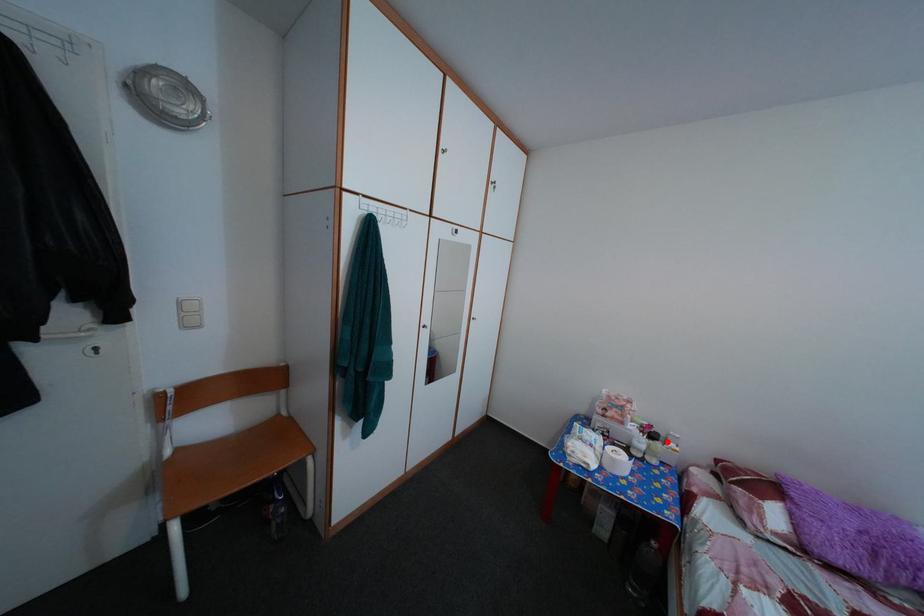
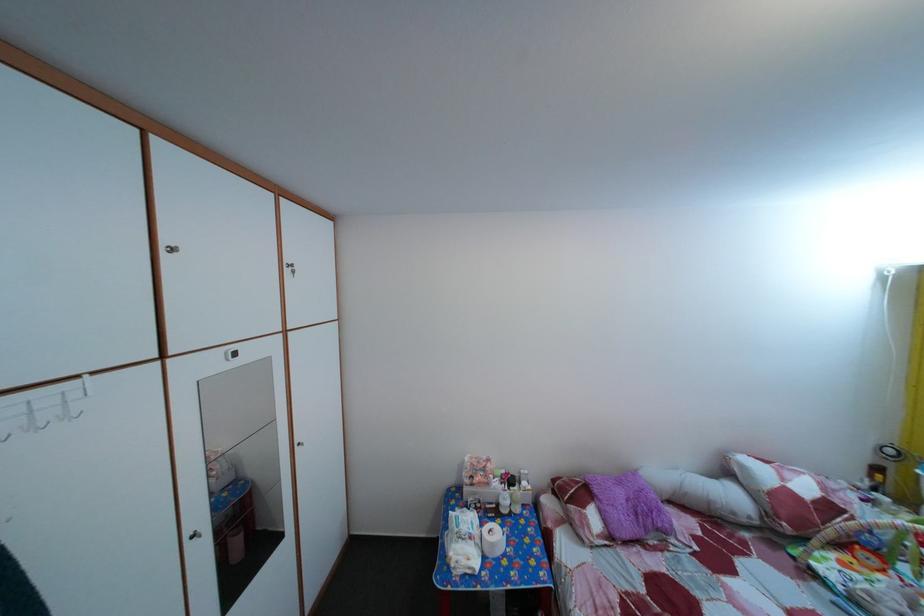
Question: I am providing you with two images of the same scene from different viewpoints. A red point is marked on the first image. Can you still see the location of the red point in image 2?

Choices:
 (A) Yes
 (B) No

Answer: (A)